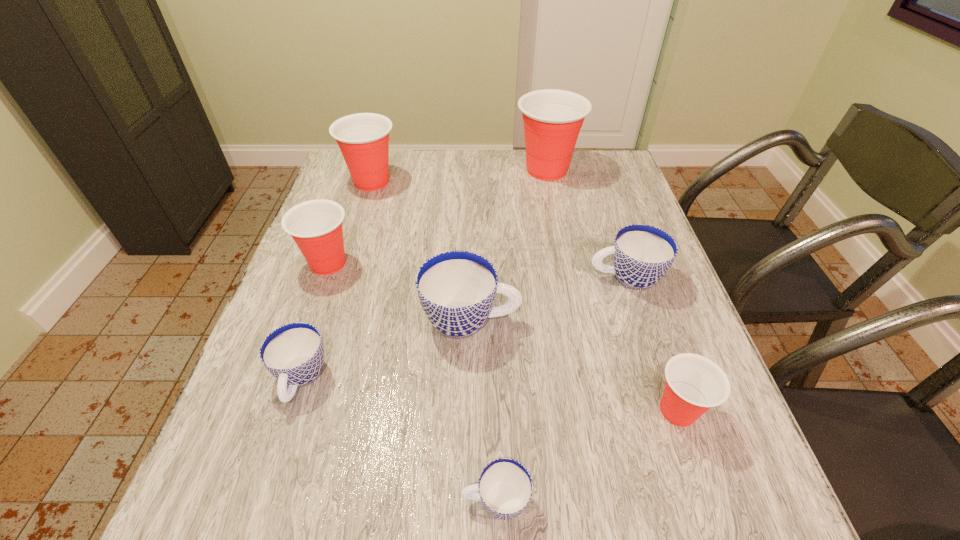
Locate an element on the screen. vacant area at the far left corner is located at coordinates (337, 179).

Locate an element on the screen. free location at the far right corner is located at coordinates (615, 162).

Where is `free space between the third farthest red cup and the tallest object`? The width and height of the screenshot is (960, 540). free space between the third farthest red cup and the tallest object is located at coordinates (438, 217).

Image resolution: width=960 pixels, height=540 pixels. I want to click on free space between the rightmost blue cup and the smallest red cup, so click(652, 344).

In order to click on free spot between the biggest blue cup and the seventh shortest cup in this screenshot , I will do `click(421, 251)`.

Locate an element on the screen. The height and width of the screenshot is (540, 960). unoccupied area between the second tallest cup and the nearest cup is located at coordinates (434, 341).

Image resolution: width=960 pixels, height=540 pixels. I want to click on vacant space that is in between the biggest blue cup and the second biggest blue cup, so click(x=548, y=299).

Identify the location of free space between the seventh shortest cup and the smallest red cup. This screenshot has width=960, height=540. (525, 296).

At what (x,y) coordinates should I click in order to perform the action: click on vacant area between the biggest blue cup and the second nearest red cup. Please return your answer as a coordinate pair (x, y). This screenshot has width=960, height=540. Looking at the image, I should click on (399, 292).

Where is `free area in between the rightmost blue cup and the smallest red cup`? free area in between the rightmost blue cup and the smallest red cup is located at coordinates click(652, 344).